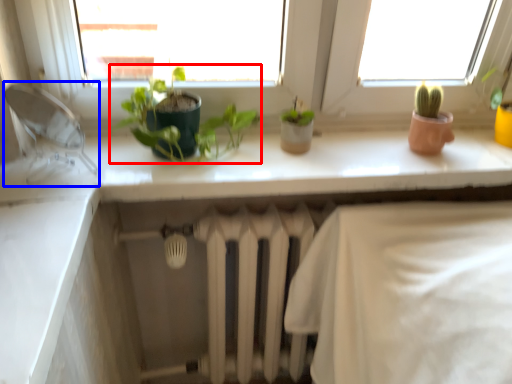
Question: Which of the following is the farthest to the observer, houseplant (highlighted by a red box) or faucet (highlighted by a blue box)?

Choices:
 (A) houseplant
 (B) faucet

Answer: (A)